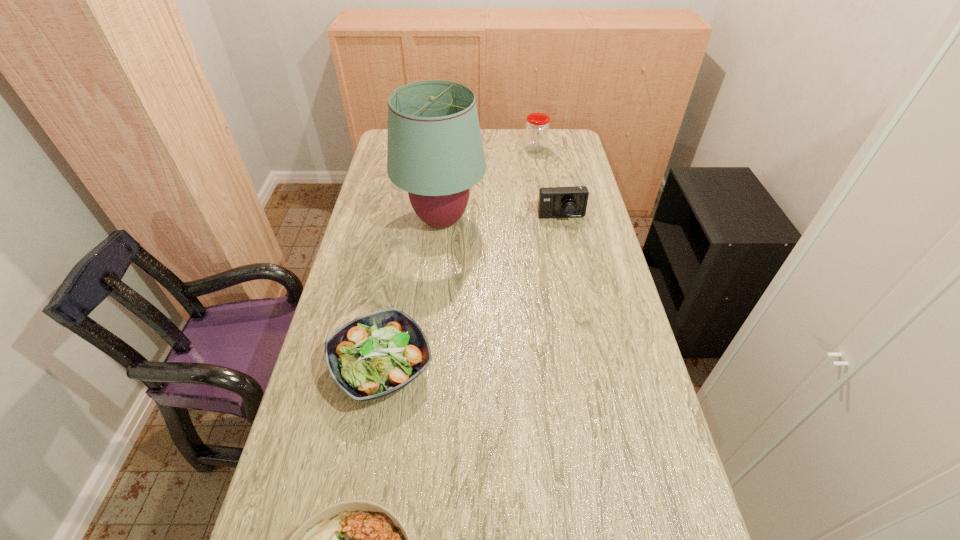
Where is `blank space at the far right corner`? The width and height of the screenshot is (960, 540). blank space at the far right corner is located at coordinates (545, 150).

The image size is (960, 540). Identify the location of free space between the lampshade and the camera. (501, 219).

What are the coordinates of `empty location between the camera and the tallest object` in the screenshot? It's located at (501, 219).

You are a GUI agent. You are given a task and a screenshot of the screen. Output one action in this format:
    pyautogui.click(x=<x>, y=<y>)
    Task: Click on the vacant space in between the taller salad plate and the tallest object
    This screenshot has width=960, height=540.
    Given the screenshot: What is the action you would take?
    pyautogui.click(x=412, y=294)

Image resolution: width=960 pixels, height=540 pixels. I want to click on object that ranks as the fourth closest to the lampshade, so point(355,539).

Image resolution: width=960 pixels, height=540 pixels. I want to click on object that is the closest to the camera, so (x=435, y=152).

Find the location of a particular element. The width and height of the screenshot is (960, 540). free location that satisfies the following two spatial constraints: 1. on the back side of the fourth shortest object; 2. on the right side of the tallest object is located at coordinates (448, 150).

Identify the location of free space that satisfies the following two spatial constraints: 1. on the back side of the lampshade; 2. on the left side of the second tallest object. The image size is (960, 540). (448, 150).

Locate an element on the screen. free point that satisfies the following two spatial constraints: 1. on the back side of the second tallest object; 2. on the left side of the lampshade is located at coordinates (448, 150).